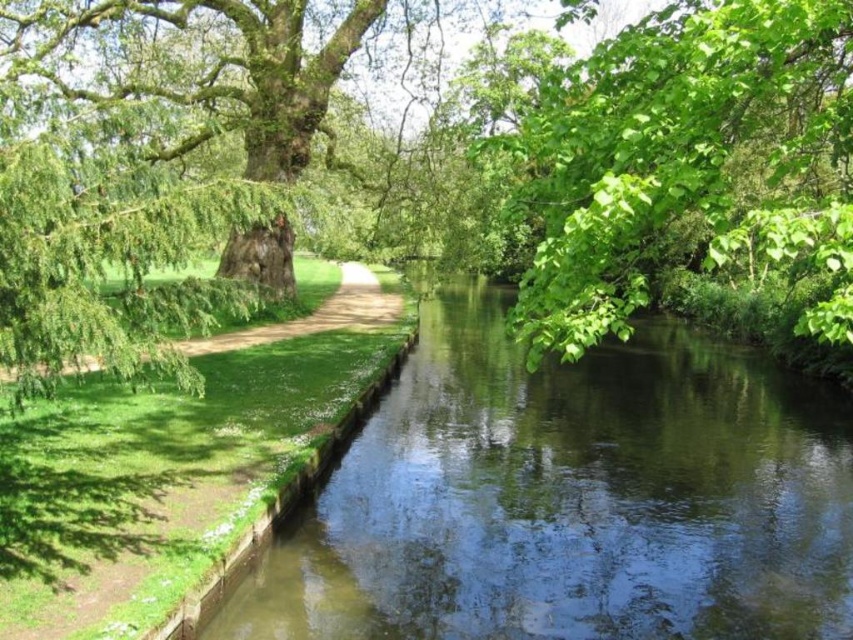
Question: Can you confirm if green smooth water at center is bigger than green leafy tree at upper right?

Choices:
 (A) yes
 (B) no

Answer: (B)

Question: Estimate the real-world distances between objects in this image. Which object is farther from the green grassy path at center?

Choices:
 (A) green leafy tree at upper right
 (B) green smooth water at center

Answer: (A)

Question: Which point is farther from the camera taking this photo?

Choices:
 (A) (526, 310)
 (B) (235, 342)

Answer: (B)

Question: Estimate the real-world distances between objects in this image. Which object is closer to the green grassy path at center?

Choices:
 (A) green leafy tree at upper right
 (B) green smooth water at center

Answer: (B)

Question: Does green smooth water at center appear under green grassy path at center?

Choices:
 (A) yes
 (B) no

Answer: (A)

Question: Can you confirm if green leafy tree at upper right is wider than green grassy path at center?

Choices:
 (A) yes
 (B) no

Answer: (A)